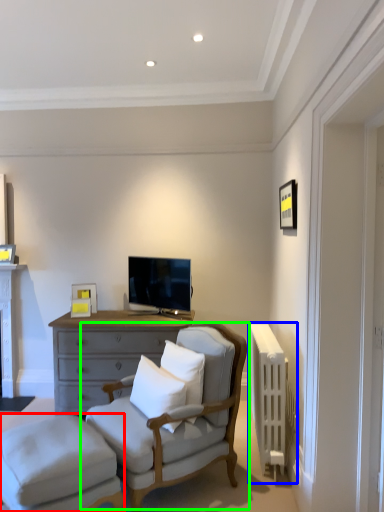
Question: Which object is the closest to the stool (highlighted by a red box)? Choose among these: radiator (highlighted by a blue box) or chair (highlighted by a green box).

Choices:
 (A) radiator
 (B) chair

Answer: (B)